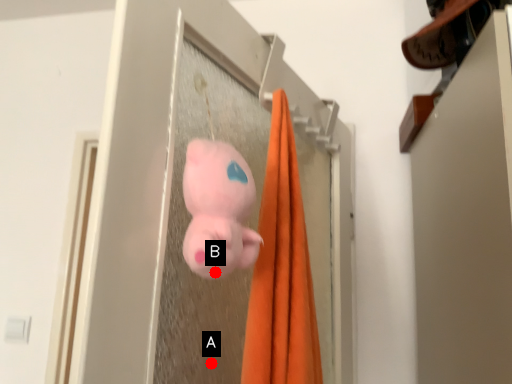
Question: Two points are circled on the image, labeled by A and B beside each circle. Which point is closer to the camera?

Choices:
 (A) A is closer
 (B) B is closer

Answer: (B)